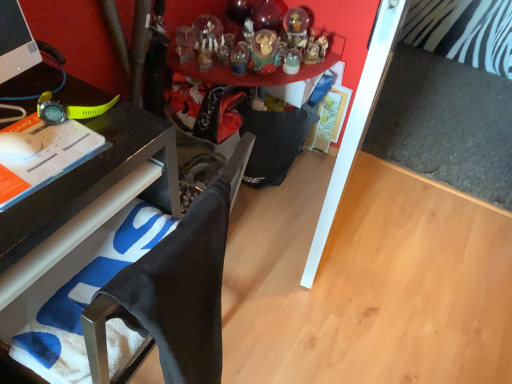
Image resolution: width=512 pixels, height=384 pixels. I want to click on vacant space to the right of matte black watch at left, so click(x=113, y=137).